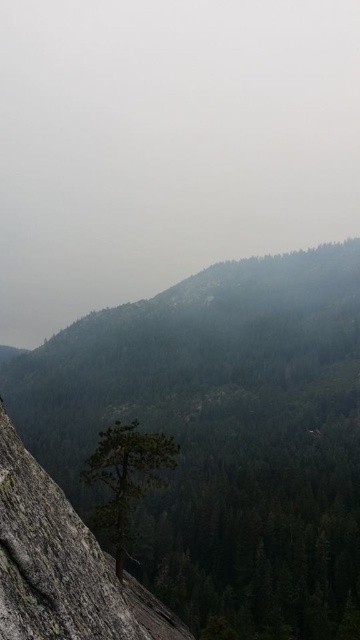
You are a hiker standing at the top of a mountain and looking at the green textured tree at center and the gray rough rock at center. Which object is closer to you?

The green textured tree at center is closer to you because it is further to the viewer than the gray rough rock at center.

You are an environmental scientist studying the mountain ecosystem. You observe the green textured tree at center and the gray rough rock at center. Which object is positioned more to the east if the image is oriented with north at the top?

The green textured tree at center is to the left of the gray rough rock at center. Since the image is oriented with north at the top, left corresponds to west. Therefore, the gray rough rock at center is positioned more to the east than the green textured tree at center.